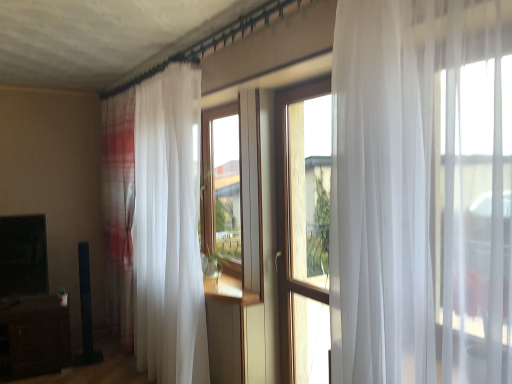
Question: Can you see brown wood entertainment center at lower left touching white sheer curtain at left?

Choices:
 (A) yes
 (B) no

Answer: (B)

Question: Is brown wood entertainment center at lower left looking in the opposite direction of white sheer curtain at left?

Choices:
 (A) no
 (B) yes

Answer: (A)

Question: Does brown wood entertainment center at lower left have a larger size compared to white sheer curtain at left?

Choices:
 (A) no
 (B) yes

Answer: (A)

Question: From the image's perspective, is brown wood entertainment center at lower left under white sheer curtain at left?

Choices:
 (A) yes
 (B) no

Answer: (A)

Question: Is brown wood entertainment center at lower left not inside white sheer curtain at left?

Choices:
 (A) no
 (B) yes

Answer: (B)

Question: Would you say brown wood entertainment center at lower left contains white sheer curtain at left?

Choices:
 (A) yes
 (B) no

Answer: (B)

Question: Can you confirm if wooden window at center is smaller than white sheer curtain at left?

Choices:
 (A) yes
 (B) no

Answer: (A)

Question: Does wooden window at center have a greater height compared to white sheer curtain at left?

Choices:
 (A) no
 (B) yes

Answer: (A)

Question: From a real-world perspective, is wooden window at center beneath white sheer curtain at left?

Choices:
 (A) yes
 (B) no

Answer: (A)

Question: Does wooden window at center have a lesser width compared to white sheer curtain at left?

Choices:
 (A) no
 (B) yes

Answer: (B)

Question: Is wooden window at center to the right of white sheer curtain at left from the viewer's perspective?

Choices:
 (A) no
 (B) yes

Answer: (B)

Question: Is white sheer curtain at left at the back of wooden window at center?

Choices:
 (A) yes
 (B) no

Answer: (B)

Question: From a real-world perspective, is wooden window at center physically below brown wood entertainment center at lower left?

Choices:
 (A) no
 (B) yes

Answer: (A)